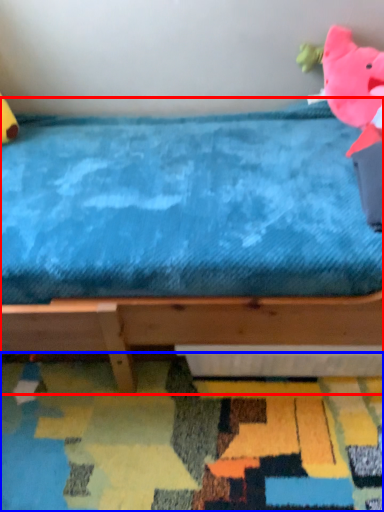
Question: Which point is further to the camera, bed (highlighted by a red box) or mat (highlighted by a blue box)?

Choices:
 (A) bed
 (B) mat

Answer: (B)